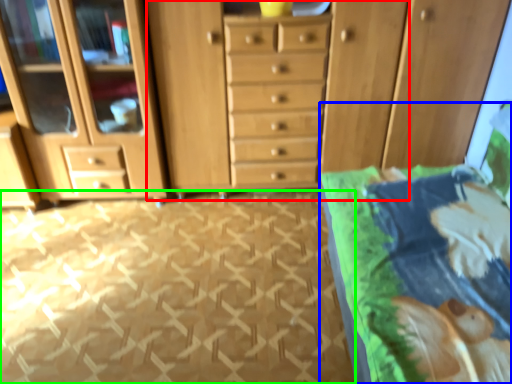
Question: Which object is positioned farthest from dresser (highlighted by a red box)? Select from bed (highlighted by a blue box) and tile (highlighted by a green box).

Choices:
 (A) bed
 (B) tile

Answer: (A)